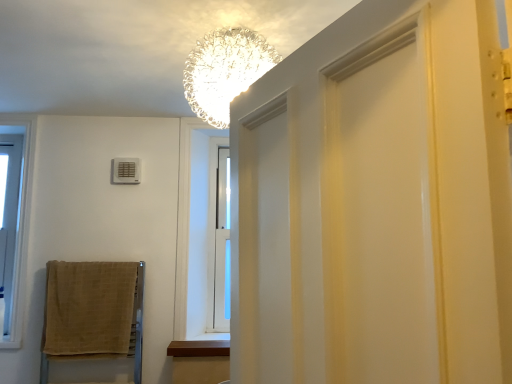
You are a GUI agent. You are given a task and a screenshot of the screen. Output one action in this format:
    pyautogui.click(x=<x>, y=<y>)
    Task: Click on the free space above brown wood at lower center (from a real-world perspective)
    This screenshot has height=384, width=512.
    Given the screenshot: What is the action you would take?
    pyautogui.click(x=201, y=347)